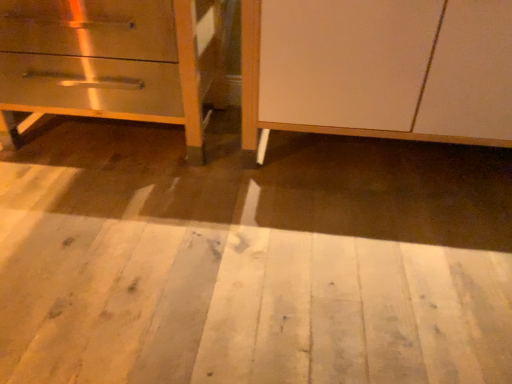
You are a GUI agent. You are given a task and a screenshot of the screen. Output one action in this format:
    pyautogui.click(x=<x>, y=<y>)
    Task: Click on the unoccupied area in front of white matte cabinet at center
    
    Given the screenshot: What is the action you would take?
    pyautogui.click(x=331, y=287)